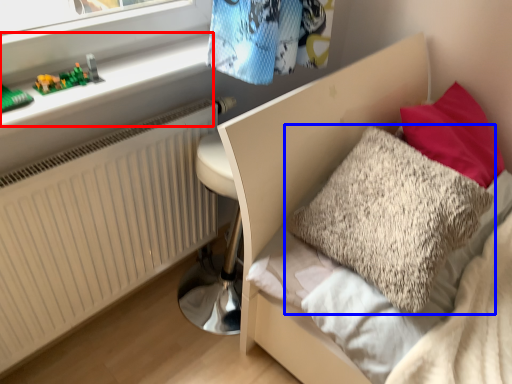
Question: Among these objects, which one is nearest to the camera, window sill (highlighted by a red box) or pillow (highlighted by a blue box)?

Choices:
 (A) window sill
 (B) pillow

Answer: (B)